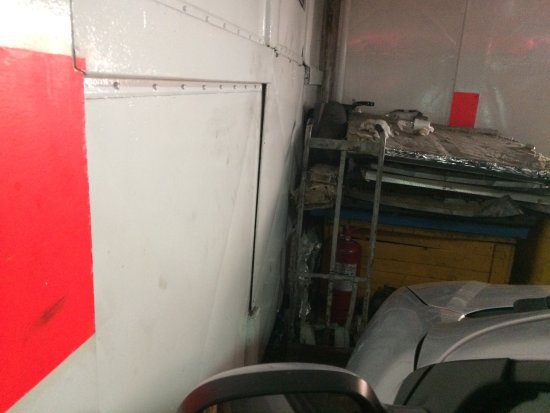
This screenshot has width=550, height=413. Find the location of `red rectangles painted on walls`. red rectangles painted on walls is located at coordinates (28, 313), (468, 106).